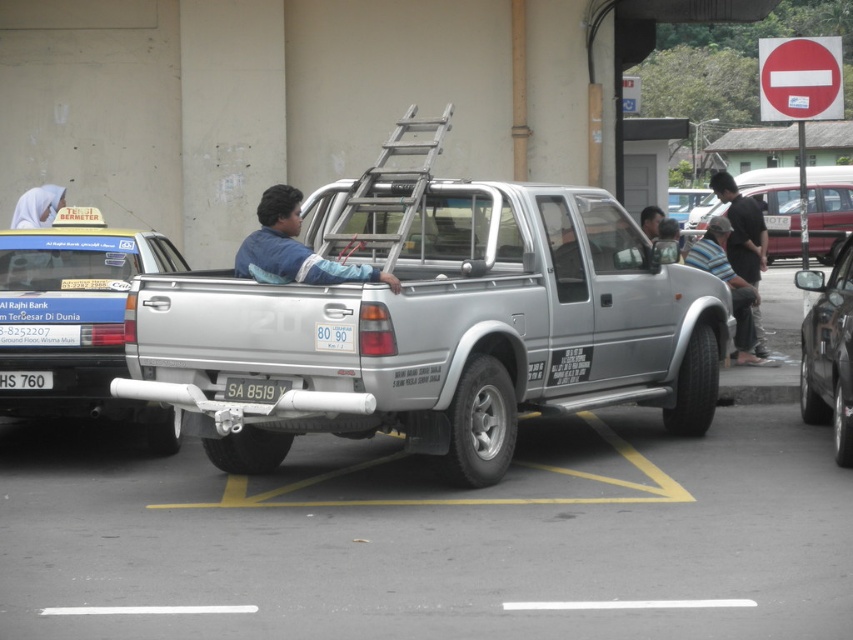
Question: Among these points, which one is farthest from the camera?

Choices:
 (A) (28, 387)
 (B) (782, 252)
 (C) (735, 209)
 (D) (18, 216)

Answer: (B)

Question: Can you confirm if silver metallic ladder at center is bigger than white plastic license plate at rear?

Choices:
 (A) yes
 (B) no

Answer: (A)

Question: Which point appears closest to the camera in this image?

Choices:
 (A) (833, 396)
 (B) (96, 413)
 (C) (323, 330)
 (D) (757, 220)

Answer: (C)

Question: Is blue metallic taxi at left smaller than metallic silver car at right?

Choices:
 (A) yes
 (B) no

Answer: (B)

Question: Which object appears closest to the camera in this image?

Choices:
 (A) blue metallic taxi at left
 (B) white fabric headscarf at upper left

Answer: (A)

Question: Can you confirm if metallic red pickup truck at center is wider than white fabric headscarf at upper left?

Choices:
 (A) yes
 (B) no

Answer: (A)